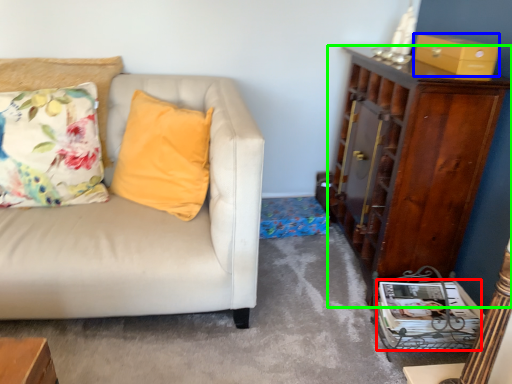
Question: Considering the real-world distances, which object is farthest from magazine (highlighted by a red box)? box (highlighted by a blue box) or cabinetry (highlighted by a green box)?

Choices:
 (A) box
 (B) cabinetry

Answer: (A)